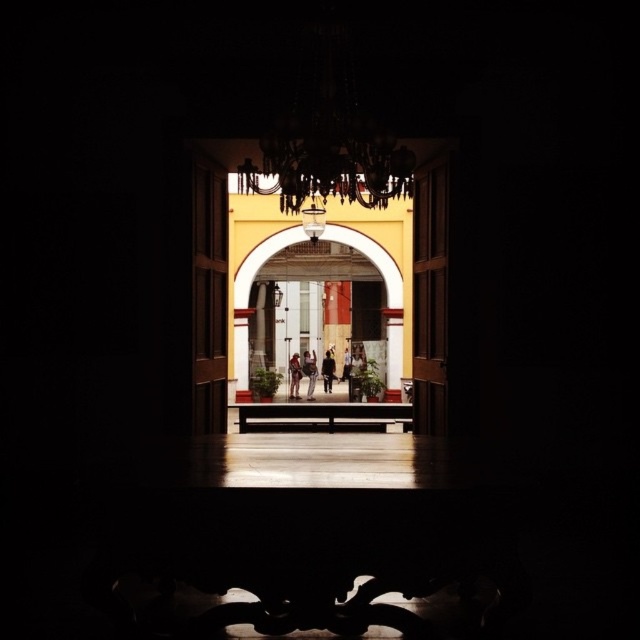
You are an interior designer assessing the space. You need to hang a large painting that requires a minimum height of 2 meters. Given the white marble archway at center and the dark brown leather jacket at center, which object can accommodate the painting in terms of height?

The white marble archway at center has a greater height compared to the dark brown leather jacket at center, so the painting can be hung on the white marble archway at center.

You are an interior designer planning to install a new chandelier. The existing silvery metallic chandelier at upper center is currently hanging in the doorway. You want to replace it with a wider chandelier. Based on the scene description, can the new wider chandelier fit without touching the white marble archway at center?

The silvery metallic chandelier at upper center is currently narrower than the white marble archway at center. Since the new chandelier is wider than the existing one, it might not fit if its width exceeds the space between the archway. However, without knowing the exact dimensions of the new chandelier or the distance between the chandelier and the archway, it is uncertain. The description only states the existing chandelier is narrower than the archway, but not the spatial relationship between them.

You are organizing a clothing store and need to arrange the matte black jacket at center and light brown leather jacket at center on a single hanger. Which jacket should you place on top to ensure both fit on the hanger without overlapping?

The light brown leather jacket at center should be placed on top since it is smaller in size compared to the matte black jacket at center, allowing both to fit without overlapping.